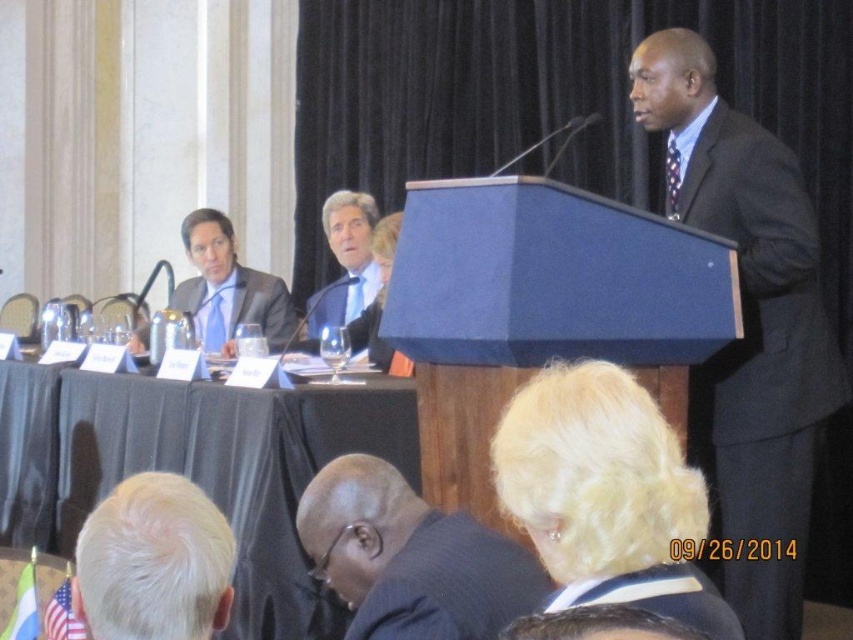
Measure the distance between black fabric table at lower center and camera.

black fabric table at lower center is 3.21 meters away from camera.

Who is positioned more to the left, black fabric table at lower center or black textured suit at lower center?

From the viewer's perspective, black fabric table at lower center appears more on the left side.

I want to click on black fabric table at lower center, so click(234, 468).

This screenshot has height=640, width=853. Describe the element at coordinates (758, 355) in the screenshot. I see `dark gray suit at center` at that location.

Is dark gray suit at center closer to camera compared to black fabric table at lower center?

Yes, it is in front of black fabric table at lower center.

Measure the distance between dark gray suit at center and camera.

They are 9.98 feet apart.

At what (x,y) coordinates should I click in order to perform the action: click on dark gray suit at center. Please return your answer as a coordinate pair (x, y). The height and width of the screenshot is (640, 853). Looking at the image, I should click on (758, 355).

Between black fabric table at lower center and matte black suit at left, which one has less height?

matte black suit at left is shorter.

Where is `black fabric table at lower center`? The height and width of the screenshot is (640, 853). black fabric table at lower center is located at coordinates (234, 468).